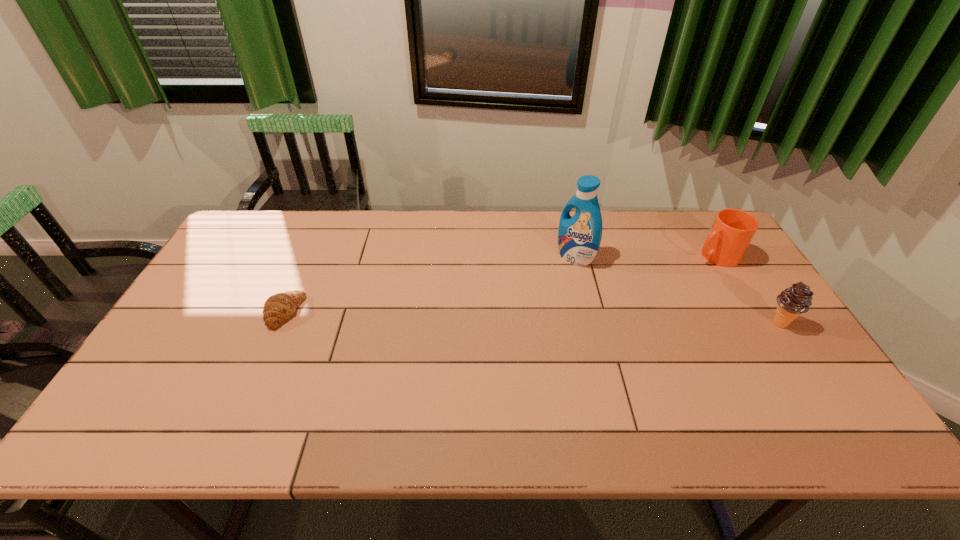
Locate an element on the screen. The image size is (960, 540). free space at the near edge of the desktop is located at coordinates (440, 402).

At what (x,y) coordinates should I click in order to perform the action: click on free region at the left edge. Please return your answer as a coordinate pair (x, y). Looking at the image, I should click on (196, 293).

Identify the location of free spot at the right edge of the desktop. (763, 354).

In the image, there is a desktop. Identify the location of vacant region at the far left corner. This screenshot has width=960, height=540. (259, 240).

You are a GUI agent. You are given a task and a screenshot of the screen. Output one action in this format:
    pyautogui.click(x=<x>, y=<y>)
    Task: Click on the vacant area at the far right corner
    Image resolution: width=960 pixels, height=540 pixels.
    Given the screenshot: What is the action you would take?
    pyautogui.click(x=693, y=215)

The image size is (960, 540). In the image, there is a desktop. In order to click on vacant space at the near right corner in this screenshot , I will do `click(838, 401)`.

What are the coordinates of `vacant space that's between the tallest object and the icecream` in the screenshot? It's located at (677, 290).

Where is `vacant space that is in between the crescent roll and the mug`? The height and width of the screenshot is (540, 960). vacant space that is in between the crescent roll and the mug is located at coordinates (499, 284).

Locate an element on the screen. The width and height of the screenshot is (960, 540). vacant region between the icecream and the tallest object is located at coordinates (677, 290).

Identify the location of free spot between the detergent and the mug. (645, 256).